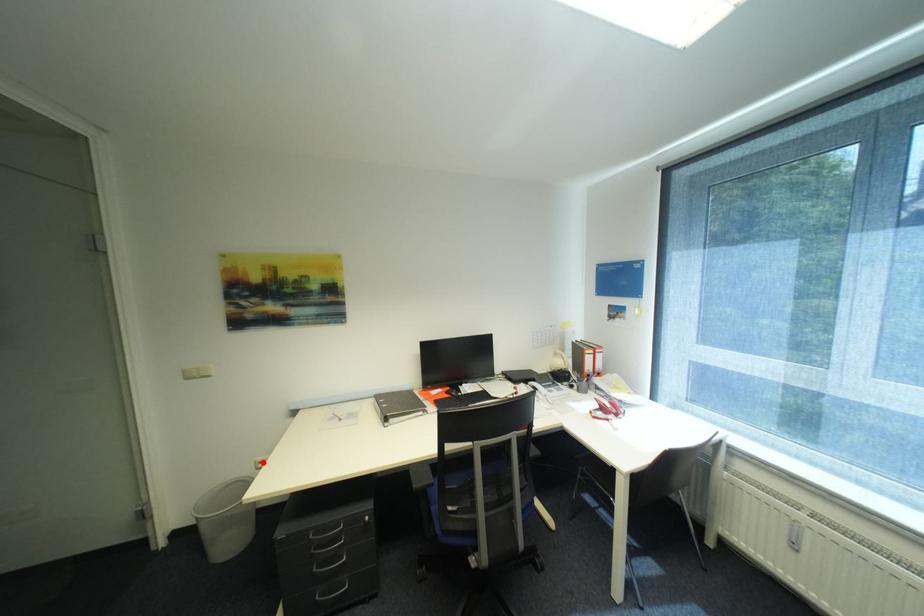
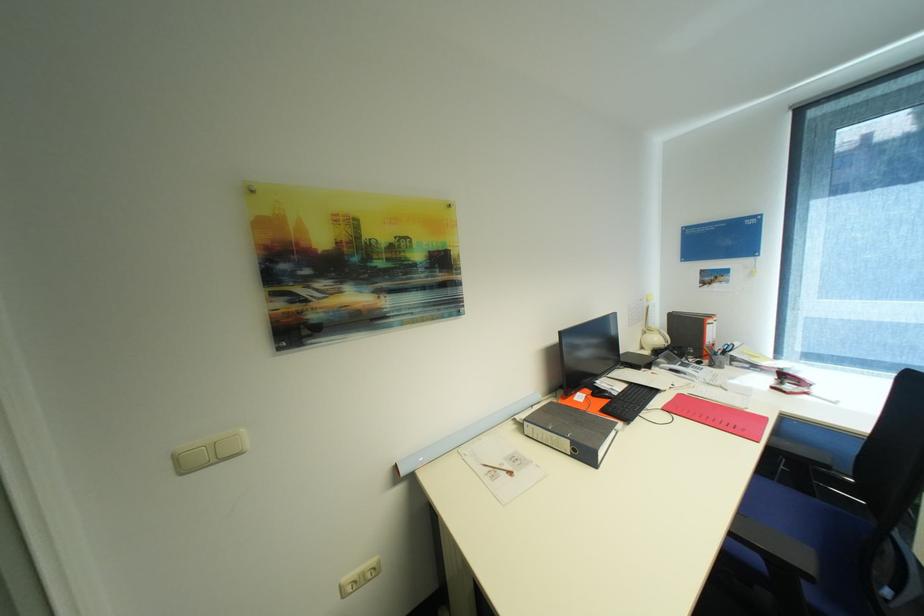
The point at the highlighted location is marked in the first image. Where is the corresponding point in the second image?

(348, 586)